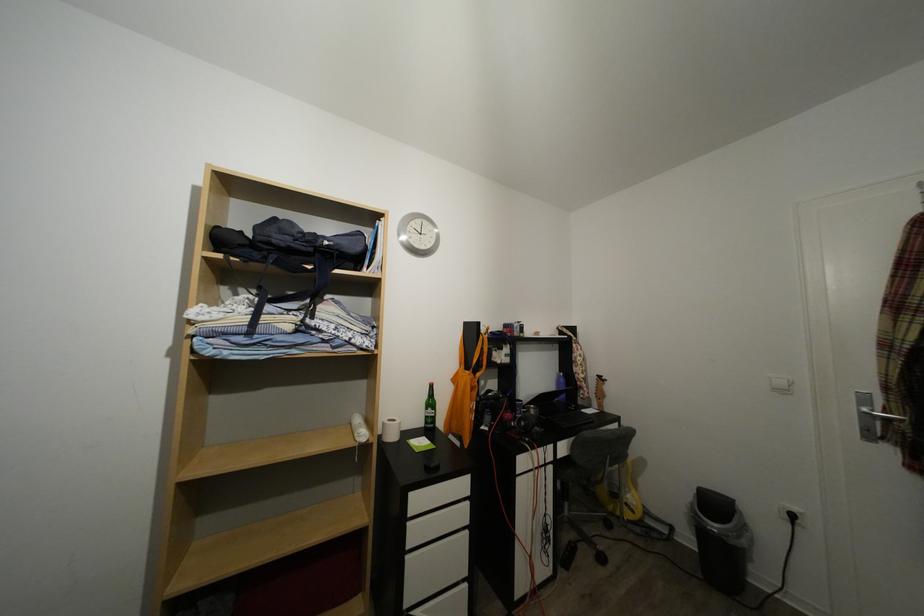
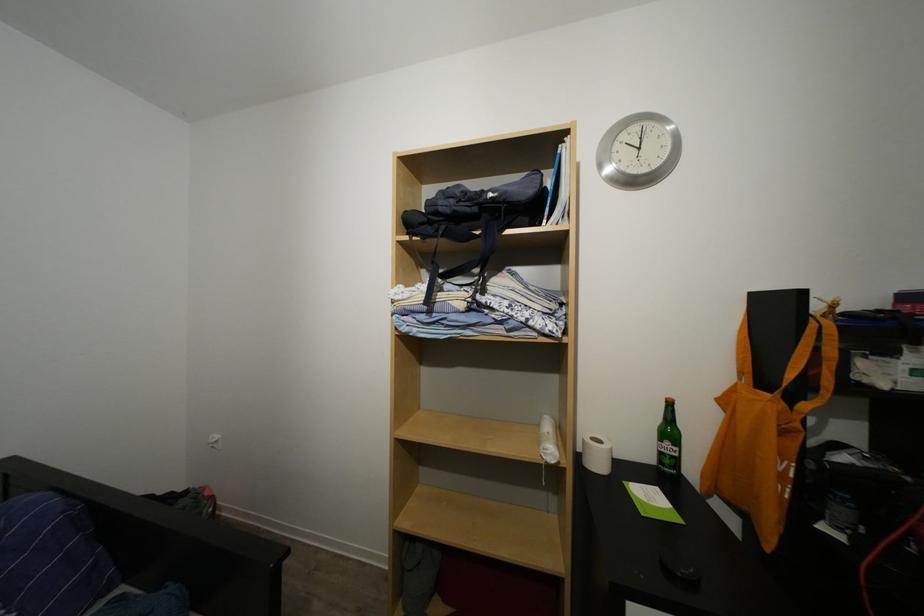
Find the pixel in the second image that matches point (417, 233) in the first image.

(625, 151)